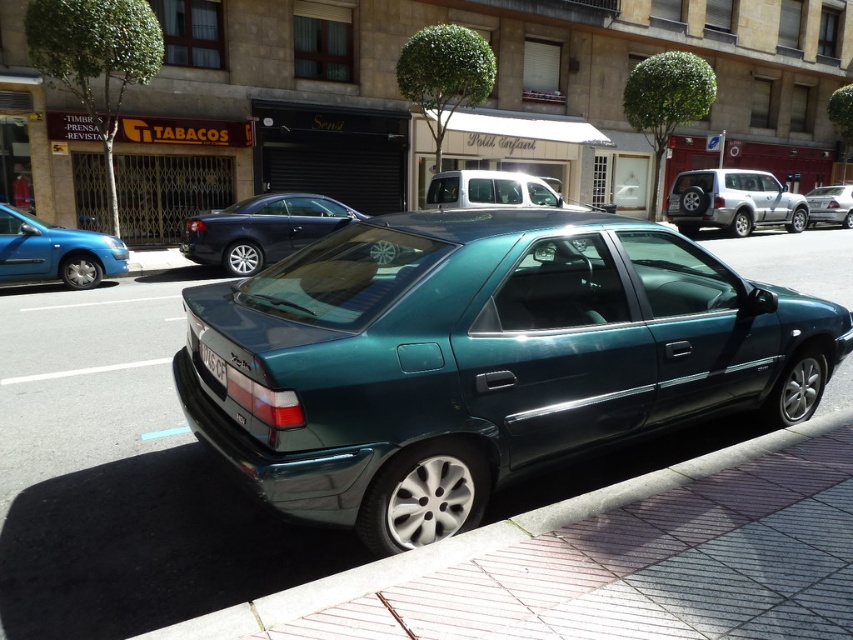
You are a delivery person needing to park your vehicle. You see the metallic blue sedan at left and metallic silver van at center. Which vehicle is closer to the curb?

The metallic blue sedan at left is closer to the curb because it is located below the metallic silver van at center, which in this context implies it is positioned lower in the frame and thus nearer to the curb level.

You are a delivery person trying to park your motorcycle between the brick pavement at lower right and the metallic silver van at center. Is there enough space for your motorcycle to fit between them?

The brick pavement at lower right is in front of the metallic silver van at center, meaning there is no space between them for the motorcycle to fit.